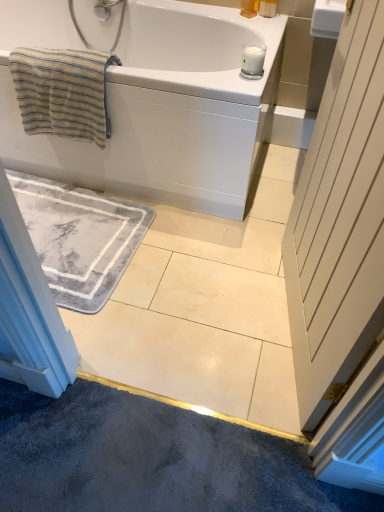
Where is `free location to the right of gray plush bath mat at lower left`? free location to the right of gray plush bath mat at lower left is located at coordinates (196, 270).